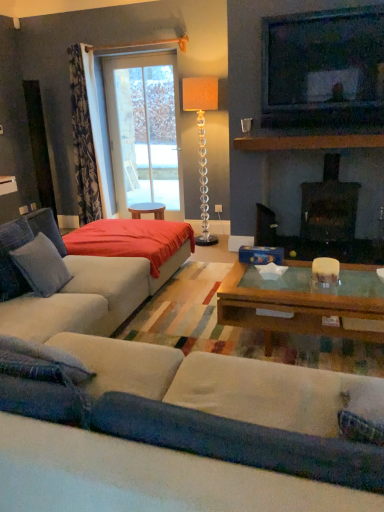
Find the location of a particular element. vacant space situated above red fabric bed at center (from a real-world perspective) is located at coordinates (108, 230).